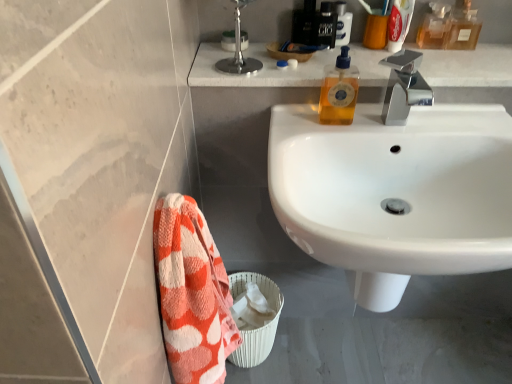
The width and height of the screenshot is (512, 384). Find the location of `vacant area that is situated to the right of transparent glass bottle at upper right, acting as the fourth mouthwash starting from the left`. vacant area that is situated to the right of transparent glass bottle at upper right, acting as the fourth mouthwash starting from the left is located at coordinates (492, 46).